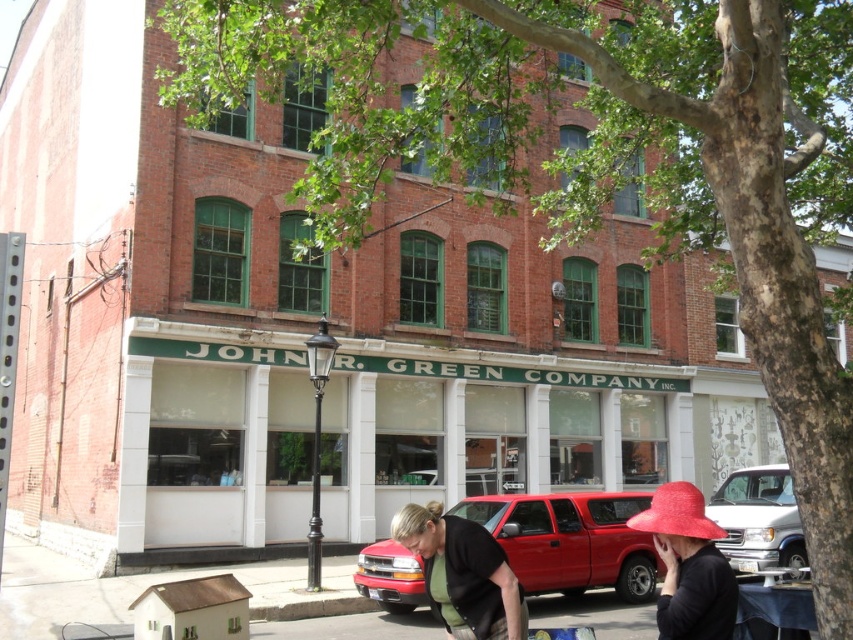
Is point (419, 506) farther from viewer compared to point (759, 516)?

No, (419, 506) is closer to viewer.

Is black matte street vendor at lower center bigger than silver metallic van at center?

No.

Which is behind, point (508, 616) or point (767, 541)?

Point (767, 541)

Image resolution: width=853 pixels, height=640 pixels. Identify the location of black matte street vendor at lower center. point(462,573).

Who is taller, metallic red truck at center or matte red hat at lower right?

metallic red truck at center is taller.

Image resolution: width=853 pixels, height=640 pixels. I want to click on metallic red truck at center, so click(x=570, y=540).

Is point (358, 584) positioned in front of point (704, 536)?

No, it is behind (704, 536).

I want to click on metallic red truck at center, so click(570, 540).

The width and height of the screenshot is (853, 640). What do you see at coordinates (688, 564) in the screenshot? I see `matte red hat at lower right` at bounding box center [688, 564].

Where is `matte red hat at lower right`? The height and width of the screenshot is (640, 853). matte red hat at lower right is located at coordinates (688, 564).